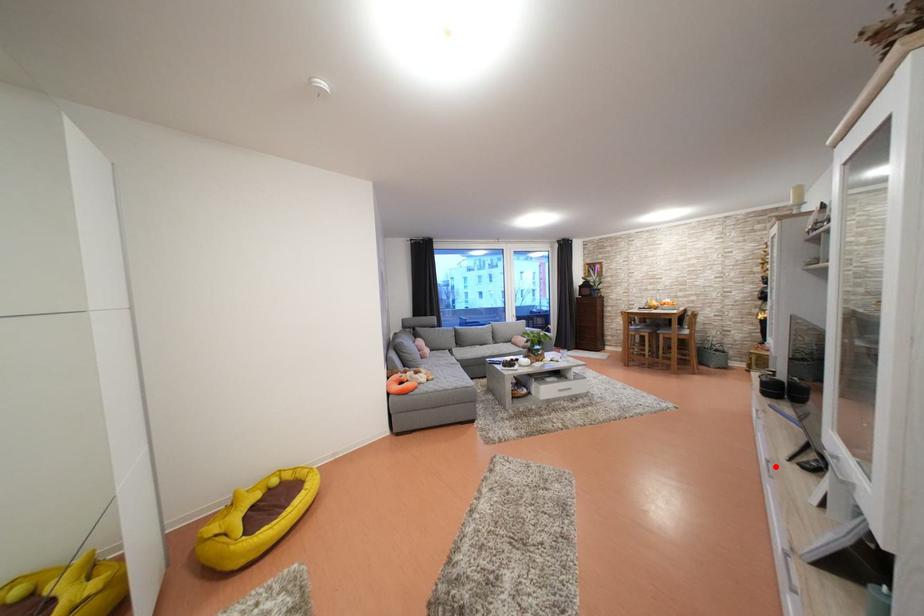
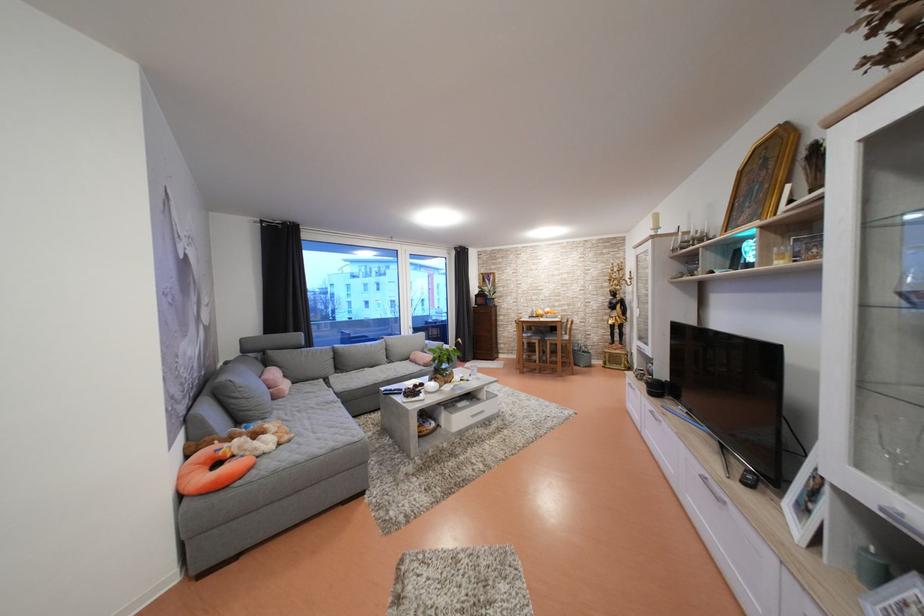
The point at the highlighted location is marked in the first image. Where is the corresponding point in the second image?

(711, 484)